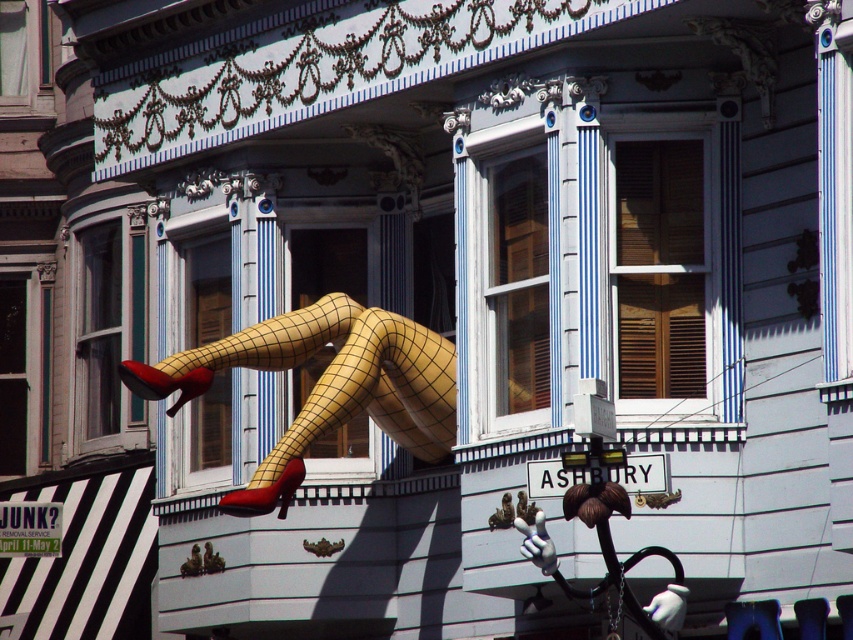
What are the coordinates of the yellow mesh legs at center?

The yellow mesh legs at center are located at coordinates point (323, 385).